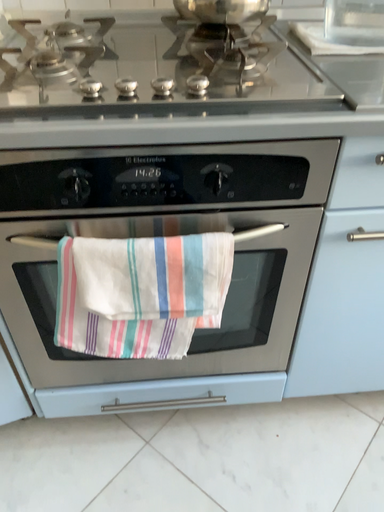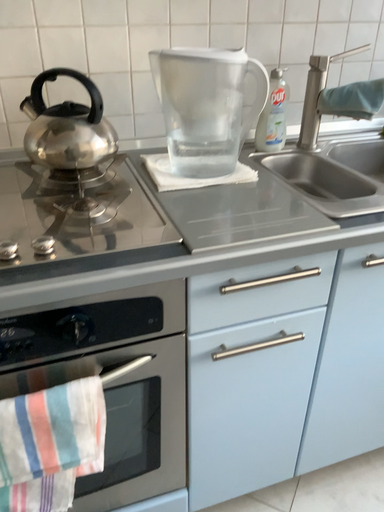
Question: Which way did the camera rotate in the video?

Choices:
 (A) rotated upward
 (B) rotated downward

Answer: (A)